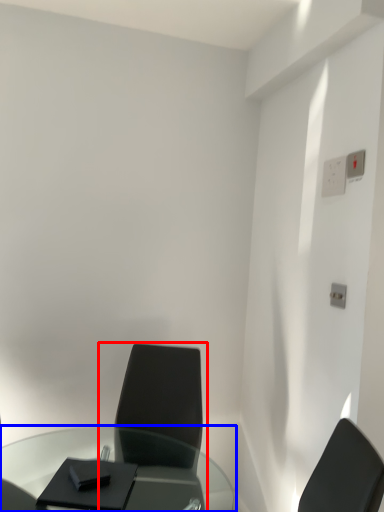
Question: Which of the following is the farthest to the observer, chair (highlighted by a red box) or table (highlighted by a blue box)?

Choices:
 (A) chair
 (B) table

Answer: (A)